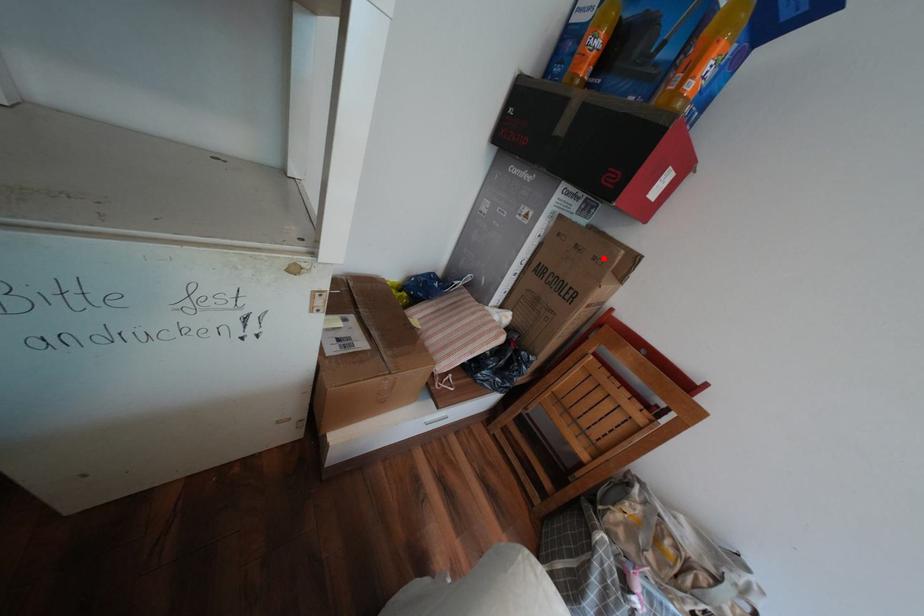
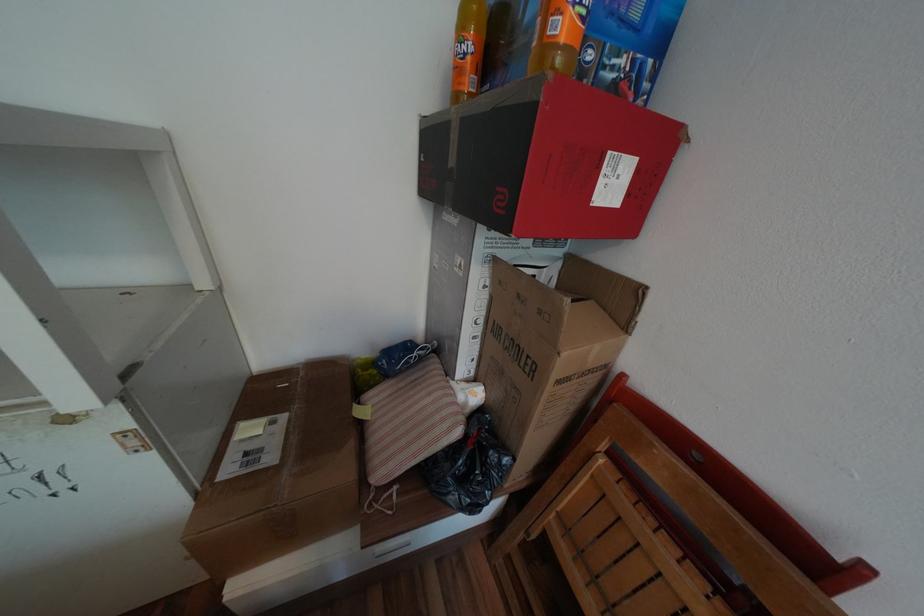
The point at the highlighted location is marked in the first image. Where is the corresponding point in the second image?

(550, 312)